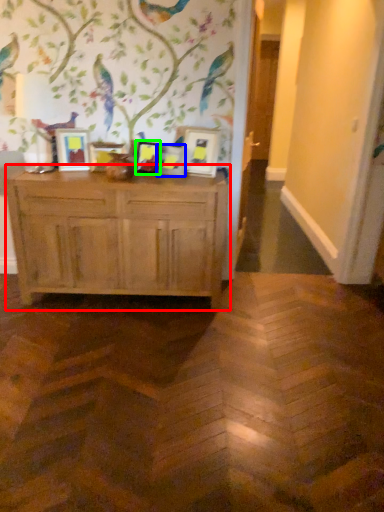
Question: Considering the real-world distances, which object is farthest from chest of drawers (highlighted by a red box)? picture frame (highlighted by a blue box) or picture frame (highlighted by a green box)?

Choices:
 (A) picture frame
 (B) picture frame

Answer: (A)